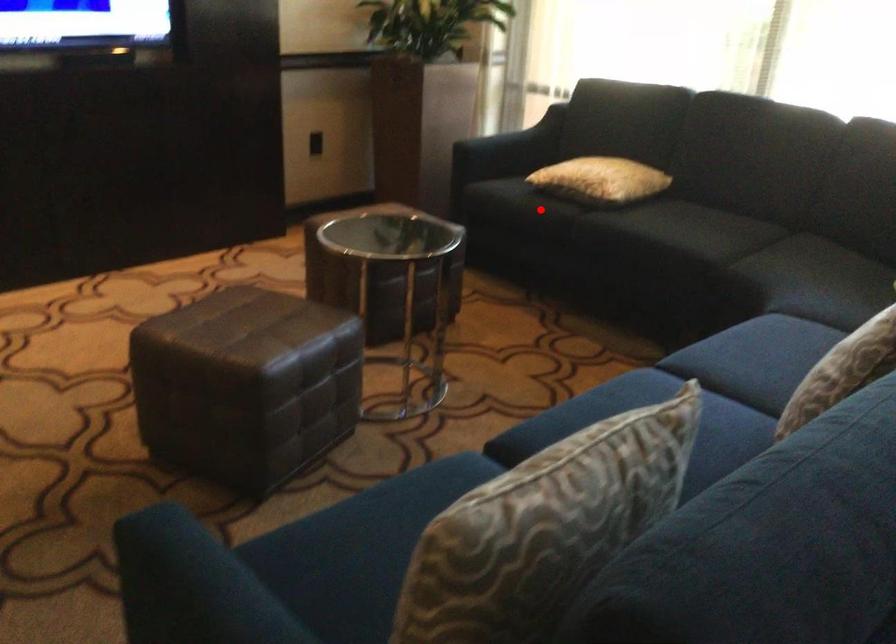
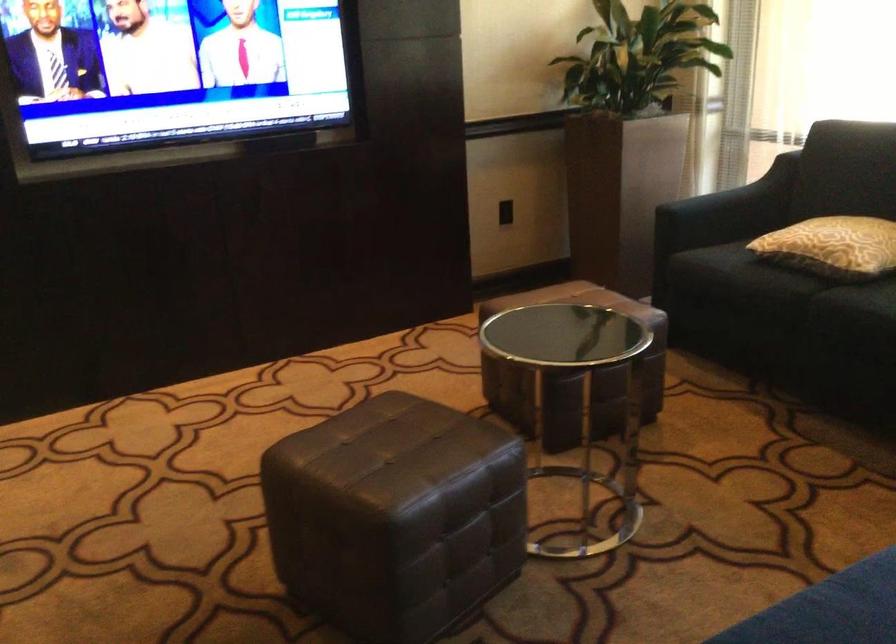
Locate, in the second image, the point that corresponds to the highlighted location in the first image.

(767, 283)